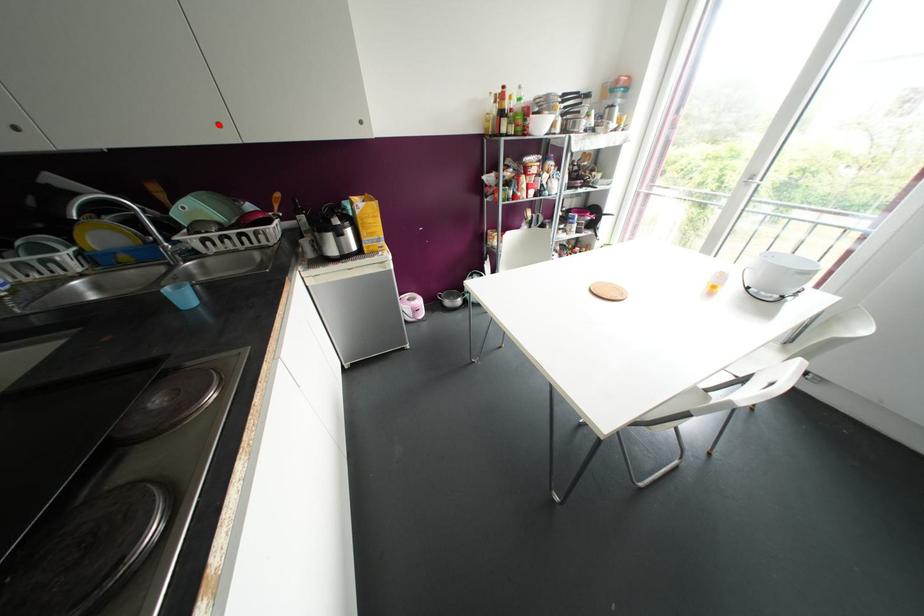
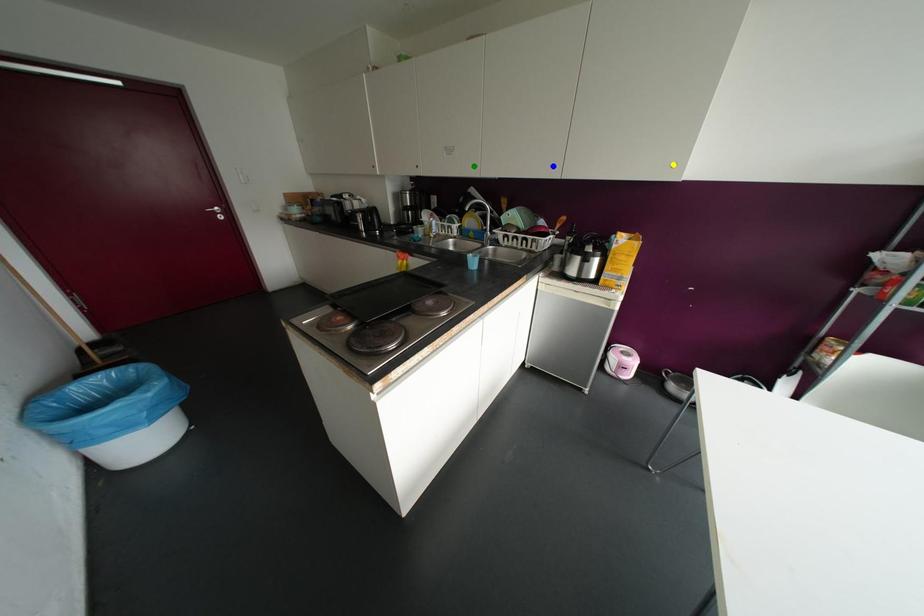
Question: I am providing you with two images of the same scene from different viewpoints. A red point is marked on the first image. You are given multiple points on the second image. Which point in image 2 represents the same 3d spot as the red point in image 1?

Choices:
 (A) yellow point
 (B) blue point
 (C) green point

Answer: (B)